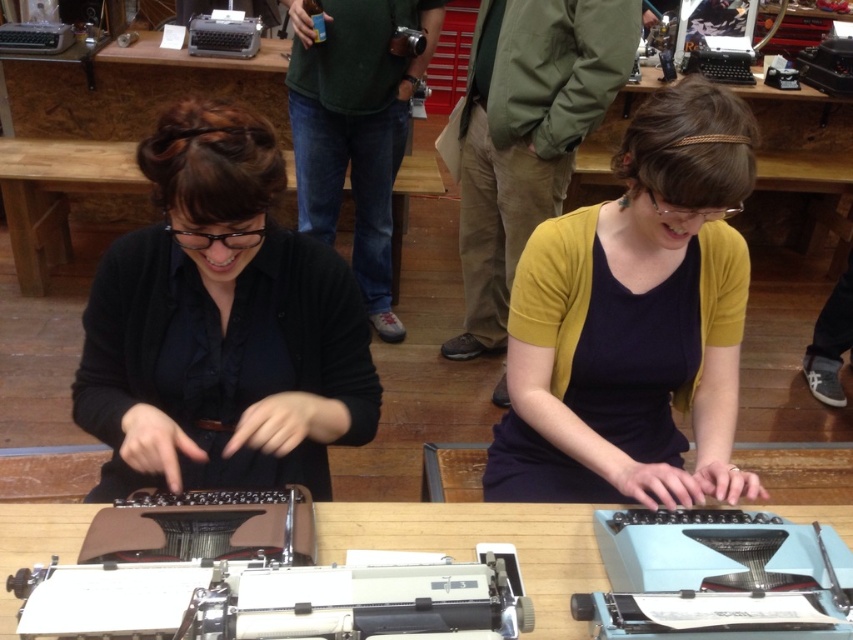
You are observing two people at a vintage typewriter workshop. You notice a black matte shirt at center and a green fabric shirt at center. Which of these shirts is shorter in height?

The black matte shirt at center is not as tall as the green fabric shirt at center, so the black matte shirt at center is shorter in height.

You are organizing a photoshoot and need to ensure that the black matte shirt at center and mustard yellow cardigan at center are visible in the frame. Based on their positions, which clothing item might require you to adjust the camera angle to capture its full width?

The black matte shirt at center might be wider than mustard yellow cardigan at center, so you might need to adjust the camera angle to ensure the black matte shirt at center is fully visible in the frame.

You are standing in the workshop and want to determine which object is taller between the black matte shirt at center and the white plastic typewriter at center. According to the scene description, which one is taller?

The black matte shirt at center is taller than the white plastic typewriter at center.